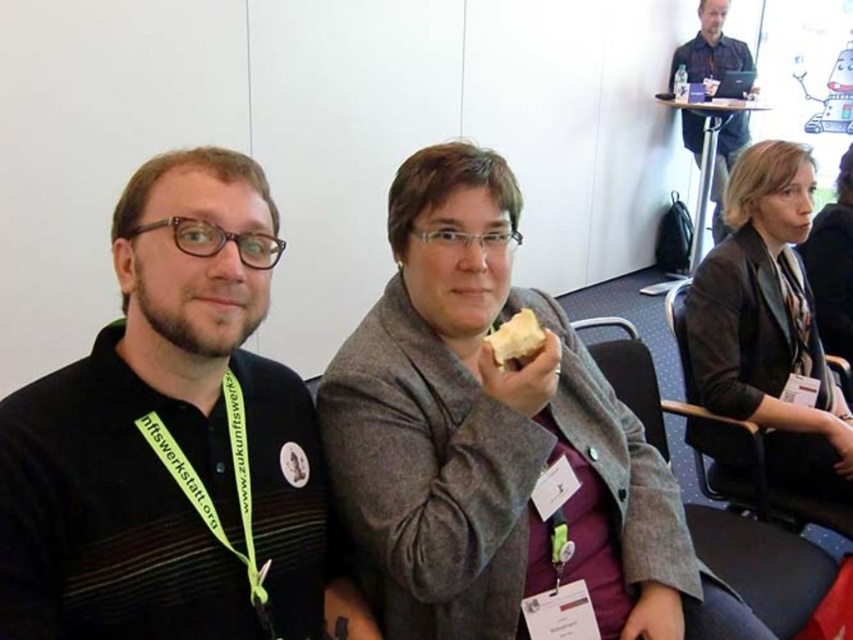
Question: Is black matte shirt at left below green fabric lanyard at left?

Choices:
 (A) yes
 (B) no

Answer: (B)

Question: Is dark gray blazer at center to the left of yellow matte bread at center from the viewer's perspective?

Choices:
 (A) no
 (B) yes

Answer: (A)

Question: Among these objects, which one is nearest to the camera?

Choices:
 (A) yellow matte bread at center
 (B) dark gray blazer at center
 (C) black matte shirt at left
 (D) matte black shirt at upper center

Answer: (C)

Question: Can you confirm if gray woolen coat at center is wider than yellow matte bread at center?

Choices:
 (A) no
 (B) yes

Answer: (B)

Question: Which point is closer to the camera?

Choices:
 (A) (721, 40)
 (B) (801, 177)

Answer: (B)

Question: Which object is farther from the camera taking this photo?

Choices:
 (A) gray woolen coat at center
 (B) matte black shirt at upper center
 (C) green fabric lanyard at left

Answer: (B)